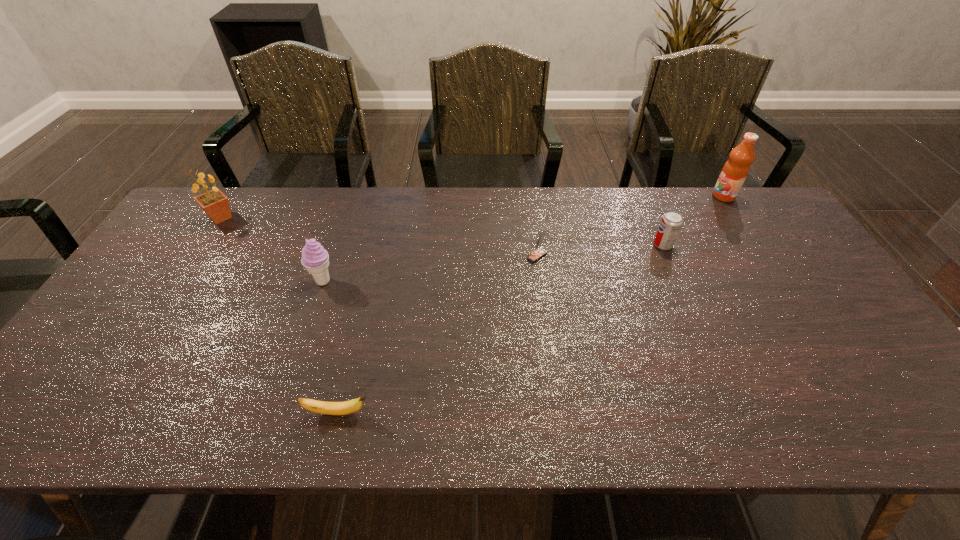
Find the location of a particular element. This screenshot has height=540, width=960. vacant space at the near left corner of the desktop is located at coordinates (93, 426).

You are a GUI agent. You are given a task and a screenshot of the screen. Output one action in this format:
    pyautogui.click(x=<x>, y=<y>)
    Task: Click on the free space at the far right corner of the desktop
    This screenshot has height=540, width=960.
    Given the screenshot: What is the action you would take?
    pyautogui.click(x=754, y=211)

What are the coordinates of `free spot at the near right corner of the desktop` in the screenshot? It's located at (848, 406).

This screenshot has height=540, width=960. Identify the location of free spot between the second nearest object and the soda. (493, 263).

Find the location of a particular element. vacant point located between the leftmost object and the fruit juice is located at coordinates (472, 207).

Identify the location of free spot between the fruit juice and the fourth object from left to right. The width and height of the screenshot is (960, 540). (630, 226).

Locate an element on the screen. This screenshot has height=540, width=960. free point between the shortest object and the soda is located at coordinates (500, 329).

The height and width of the screenshot is (540, 960). I want to click on free space between the matchbox and the second nearest object, so coord(430,268).

This screenshot has width=960, height=540. I want to click on free spot between the fifth object from left to right and the third object from left to right, so click(x=500, y=329).

Where is `free space between the matchbox and the banana`? free space between the matchbox and the banana is located at coordinates (437, 335).